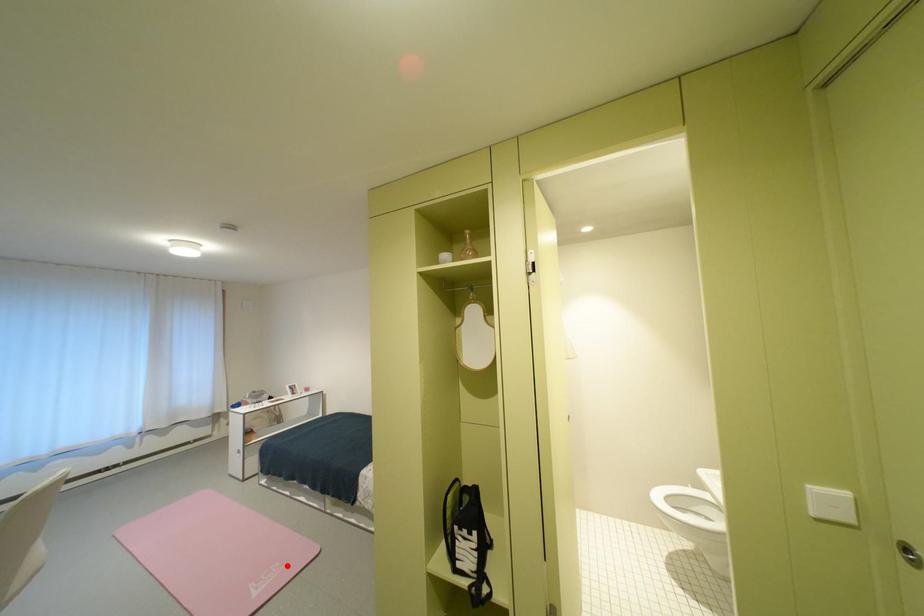
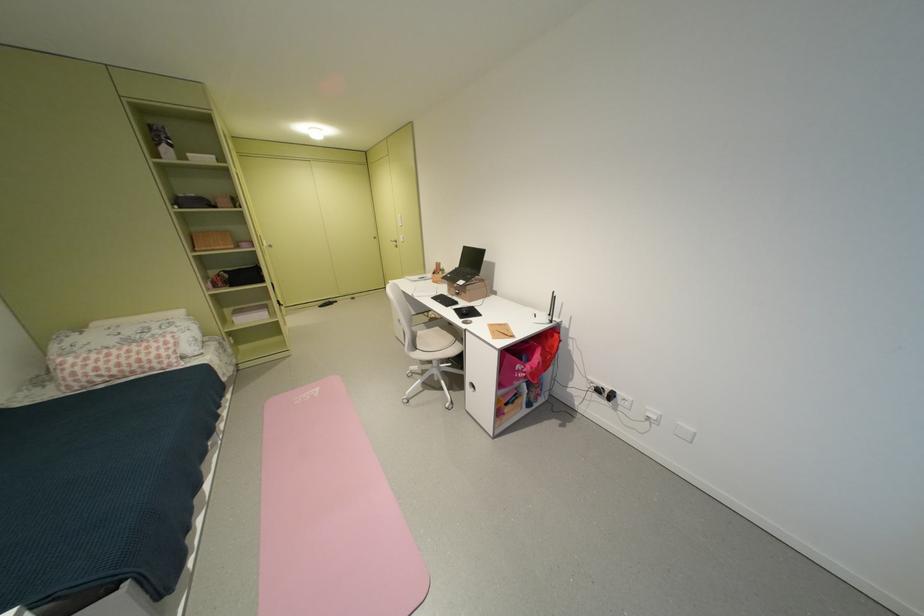
In the second image, find the point that corresponds to the highlighted location in the first image.

(305, 403)